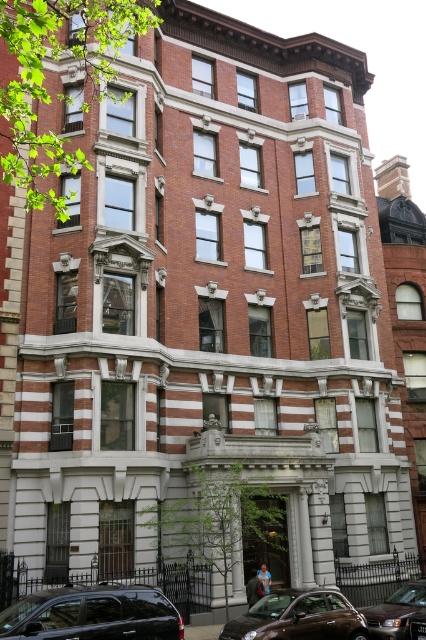
Question: From the image, what is the correct spatial relationship of shiny brown car at lower center in relation to shiny brown sedan at lower right?

Choices:
 (A) right
 (B) left

Answer: (B)

Question: Estimate the real-world distances between objects in this image. Which object is farther from the shiny black suv at lower left?

Choices:
 (A) shiny brown sedan at lower right
 (B) shiny brown car at lower center

Answer: (A)

Question: Among these points, which one is farthest from the camera?

Choices:
 (A) (386, 604)
 (B) (120, 593)

Answer: (A)

Question: Which object appears closest to the camera in this image?

Choices:
 (A) shiny brown sedan at lower right
 (B) shiny brown car at lower center

Answer: (B)

Question: Is shiny black suv at lower left bigger than shiny brown sedan at lower right?

Choices:
 (A) no
 (B) yes

Answer: (A)

Question: Does shiny black suv at lower left appear on the left side of shiny brown sedan at lower right?

Choices:
 (A) yes
 (B) no

Answer: (A)